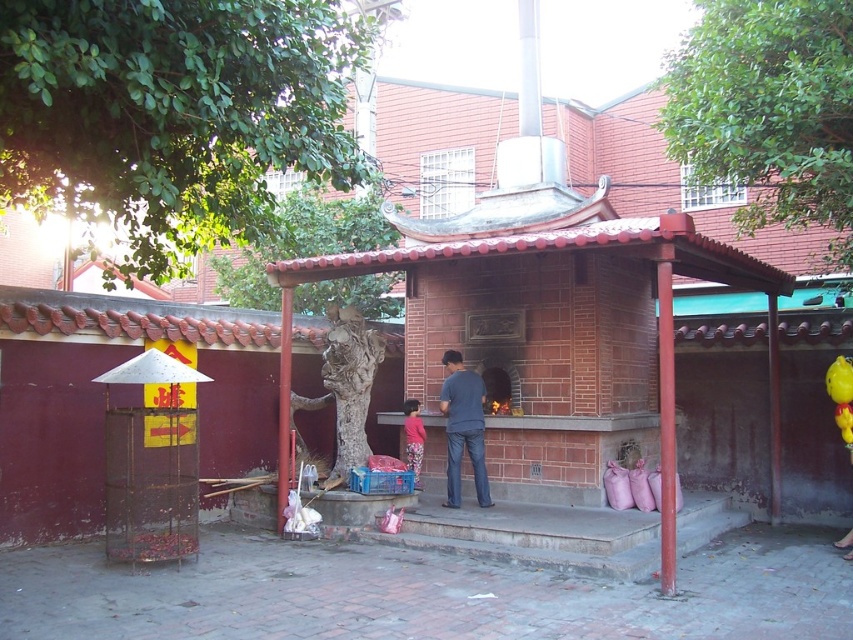
Question: Considering the real-world distances, which object is closest to the dark blue jeans at center?

Choices:
 (A) red brick shrine at center
 (B) pink floral pants at center

Answer: (B)

Question: Does red brick shrine at center have a greater width compared to dark blue jeans at center?

Choices:
 (A) yes
 (B) no

Answer: (A)

Question: Which object is positioned closest to the dark blue jeans at center?

Choices:
 (A) pink floral pants at center
 (B) red brick shrine at center

Answer: (A)

Question: Is dark blue jeans at center closer to camera compared to pink floral pants at center?

Choices:
 (A) yes
 (B) no

Answer: (A)

Question: Which of the following is the closest to the observer?

Choices:
 (A) red brick shrine at center
 (B) dark blue jeans at center

Answer: (A)

Question: Does dark blue jeans at center lie in front of pink floral pants at center?

Choices:
 (A) yes
 (B) no

Answer: (A)